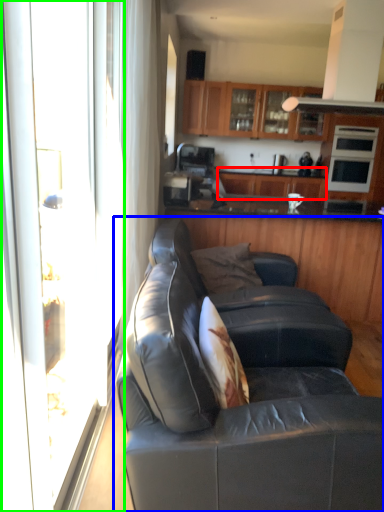
Question: Which is nearer to the cabinetry (highlighted by a red box)? studio couch (highlighted by a blue box) or screen door (highlighted by a green box).

Choices:
 (A) studio couch
 (B) screen door

Answer: (A)